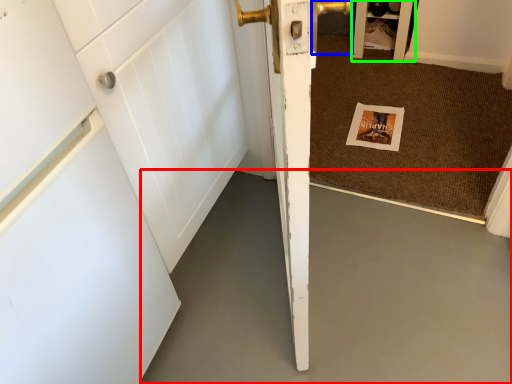
Question: Which object is positioned closest to concrete (highlighted by a red box)? Select from door handle (highlighted by a blue box) and cabinetry (highlighted by a green box).

Choices:
 (A) door handle
 (B) cabinetry

Answer: (B)